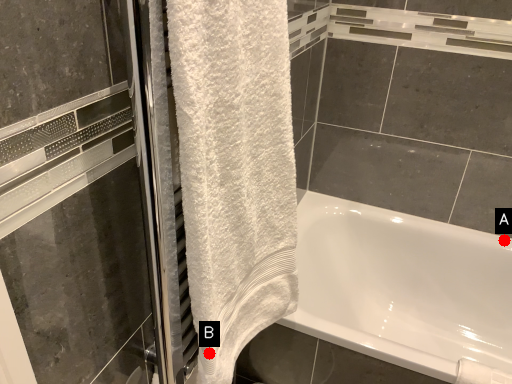
Question: Two points are circled on the image, labeled by A and B beside each circle. Which point is closer to the camera?

Choices:
 (A) A is closer
 (B) B is closer

Answer: (B)